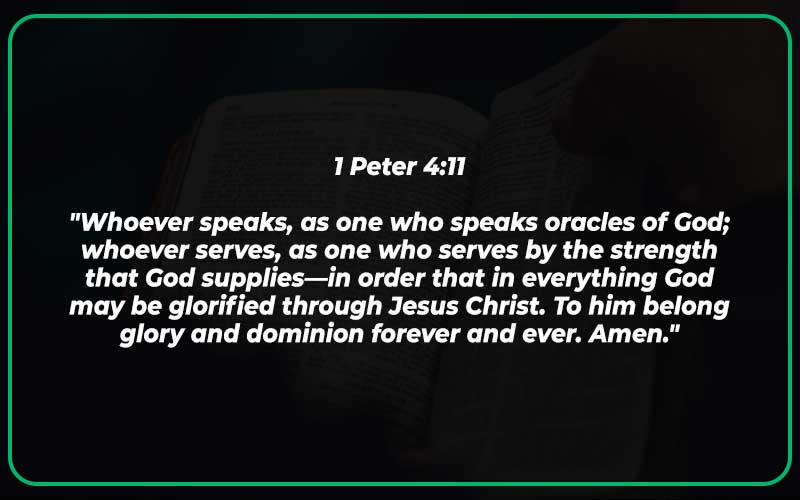
Identify the location of corners. The width and height of the screenshot is (800, 500). (6, 491), (29, 468), (774, 471), (790, 488), (793, 14), (772, 30), (12, 13), (26, 33).